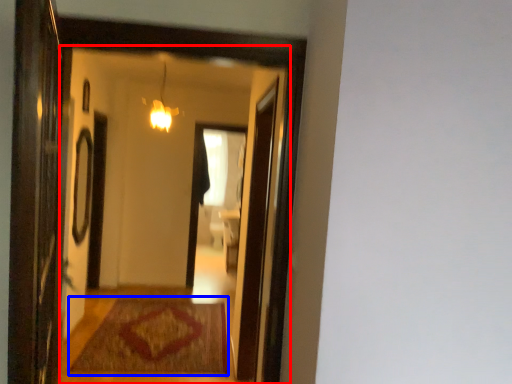
Question: Which object appears farthest to the camera in this image, mirror (highlighted by a red box) or mat (highlighted by a blue box)?

Choices:
 (A) mirror
 (B) mat

Answer: (B)